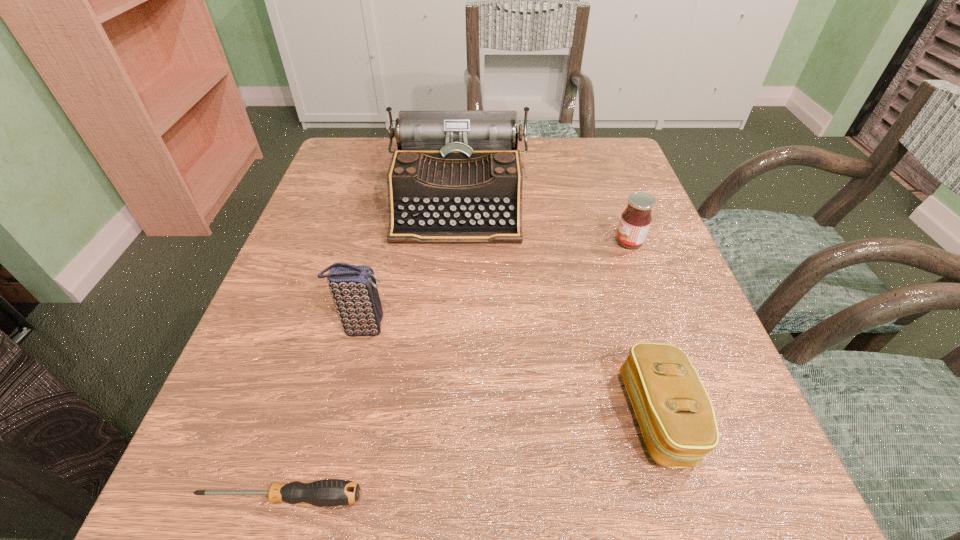
Select which object appears as the fourth closest to the typewriter. Please provide its 2D coordinates. Your answer should be formatted as a tuple, i.e. [(x, y)], where the tuple contains the x and y coordinates of a point satisfying the conditions above.

[(330, 492)]

Image resolution: width=960 pixels, height=540 pixels. What are the coordinates of `object that stands as the fourth closest to the nearest object` in the screenshot? It's located at (635, 221).

The width and height of the screenshot is (960, 540). In order to click on free spot that satisfies the following two spatial constraints: 1. on the label side of the jam; 2. on the front side of the nearest object in this screenshot , I will do `click(723, 497)`.

Identify the location of vacant position in the image that satisfies the following two spatial constraints: 1. on the keyboard of the tallest object; 2. with the zip open on the farther clutch bag. This screenshot has height=540, width=960. (450, 327).